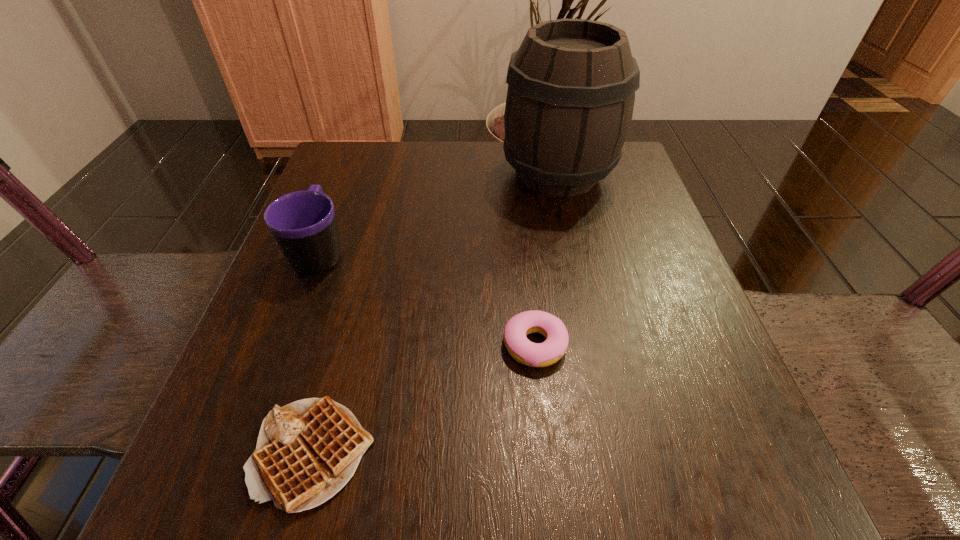
Where is `free point located on the back of the doughnut`? The width and height of the screenshot is (960, 540). free point located on the back of the doughnut is located at coordinates (521, 220).

Where is `vacant space situated on the back of the waffle`? vacant space situated on the back of the waffle is located at coordinates (361, 270).

The height and width of the screenshot is (540, 960). Find the location of `object present at the far edge`. object present at the far edge is located at coordinates click(571, 90).

Where is `object located at the near edge`? Image resolution: width=960 pixels, height=540 pixels. object located at the near edge is located at coordinates (307, 451).

Locate an element on the screen. The width and height of the screenshot is (960, 540). mug that is at the left edge is located at coordinates (303, 223).

What are the coordinates of `waffle that is positioned at the left edge` in the screenshot? It's located at (307, 451).

In order to click on object that is at the right edge in this screenshot , I will do `click(571, 90)`.

I want to click on object that is at the near left corner, so click(307, 451).

Where is `object that is positioned at the far right corner`? The height and width of the screenshot is (540, 960). object that is positioned at the far right corner is located at coordinates (571, 90).

Where is `vacant space at the far edge`? vacant space at the far edge is located at coordinates (509, 171).